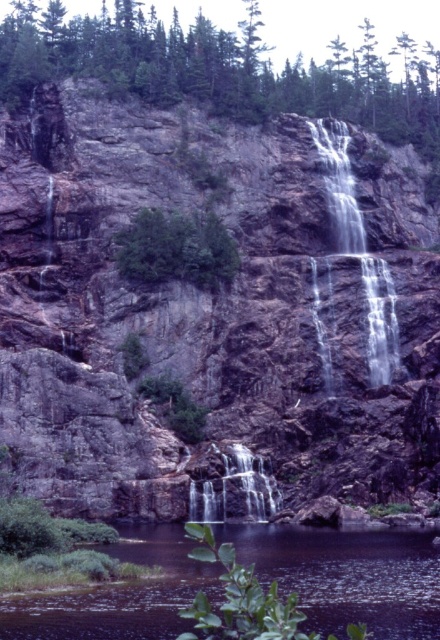
Question: Among these points, which one is farthest from the camera?

Choices:
 (A) (337, 196)
 (B) (311, 596)

Answer: (A)

Question: Does brown rough rock face at center lie behind clear water at lower center?

Choices:
 (A) yes
 (B) no

Answer: (A)

Question: Which object is the farthest from the green leafy tree at center?

Choices:
 (A) brown rough rock face at center
 (B) clear water at lower center

Answer: (B)

Question: Observing the image, what is the correct spatial positioning of clear water at center in reference to green leafy tree at center?

Choices:
 (A) above
 (B) below

Answer: (A)

Question: Which of the following is the closest to the observer?

Choices:
 (A) green leafy tree at center
 (B) clear water at lower center
 (C) brown rough rock face at center

Answer: (B)

Question: Can you confirm if clear water at lower center is bigger than translucent white water at center?

Choices:
 (A) yes
 (B) no

Answer: (A)